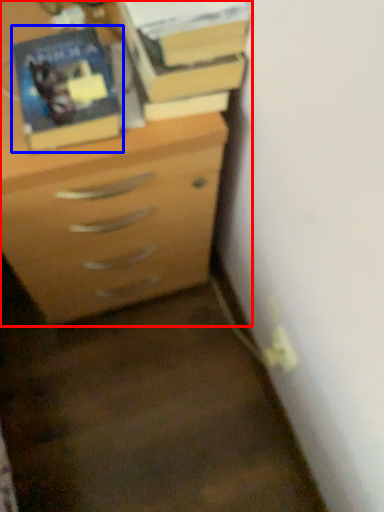
Question: Which point is further to the camera, chest of drawers (highlighted by a red box) or paperback book (highlighted by a blue box)?

Choices:
 (A) chest of drawers
 (B) paperback book

Answer: (A)